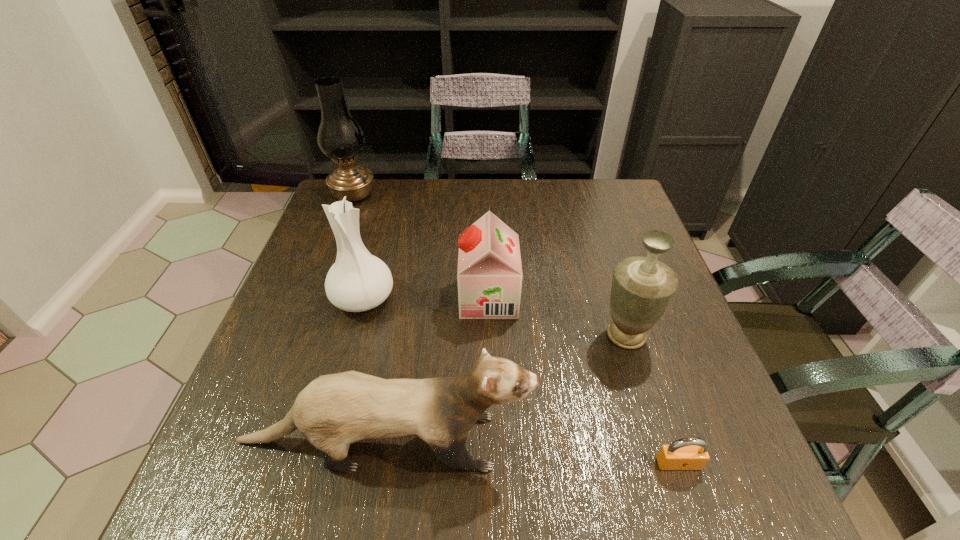
The width and height of the screenshot is (960, 540). Identify the location of empty space between the padlock and the soya milk. (584, 381).

Find the location of a particular element. Image resolution: width=960 pixels, height=540 pixels. free space between the ferret and the farthest object is located at coordinates (369, 318).

Where is `empty location between the soya milk and the padlock`? empty location between the soya milk and the padlock is located at coordinates (584, 381).

This screenshot has height=540, width=960. Find the location of `free space between the ferret and the vase`. free space between the ferret and the vase is located at coordinates (373, 370).

This screenshot has width=960, height=540. In order to click on blank region between the ferret and the soya milk in this screenshot , I will do `click(436, 369)`.

Find the location of `empty location between the ferret and the shortest object`. empty location between the ferret and the shortest object is located at coordinates (531, 453).

The height and width of the screenshot is (540, 960). Identify the location of free space that is in between the soya milk and the shortest object. (584, 381).

At what (x,y) coordinates should I click in order to perform the action: click on object that stands as the third closest to the ferret. Please return your answer as a coordinate pair (x, y). Looking at the image, I should click on (358, 281).

This screenshot has height=540, width=960. In order to click on object that is the third closest to the soya milk in this screenshot , I will do `click(334, 410)`.

Where is `free location that satisfies the following two spatial constraints: 1. on the front side of the vase; 2. on the right side of the oil lamp`? The height and width of the screenshot is (540, 960). free location that satisfies the following two spatial constraints: 1. on the front side of the vase; 2. on the right side of the oil lamp is located at coordinates (313, 298).